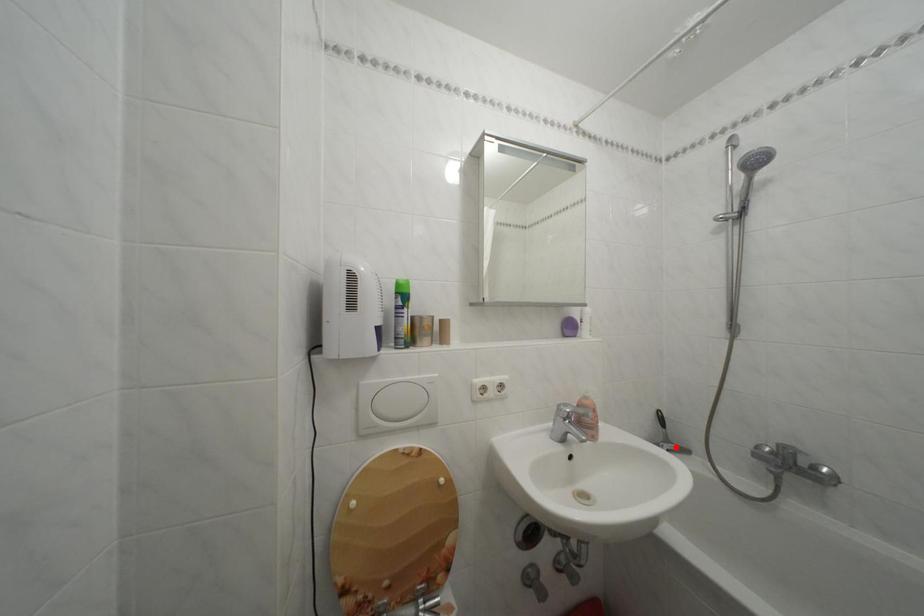
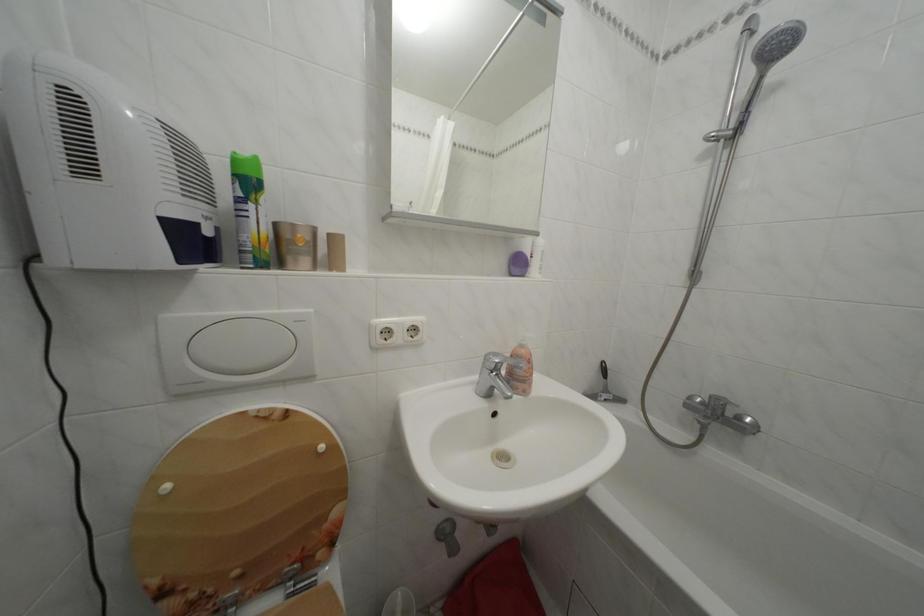
Locate, in the second image, the point that corresponds to the highlighted location in the first image.

(614, 397)